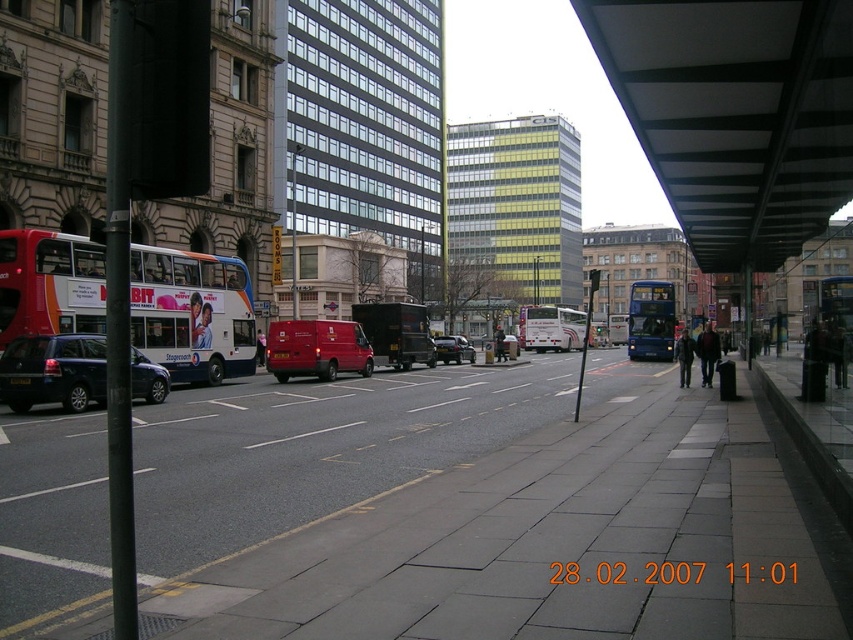
Question: Which is nearer to the matte blue bus at center?

Choices:
 (A) metallic silver car at center
 (B) red matte double-decker bus at left
 (C) matte black suv at left

Answer: (A)

Question: Can you confirm if red matte double-decker bus at left is positioned to the left of white matte bus at center?

Choices:
 (A) yes
 (B) no

Answer: (A)

Question: Estimate the real-world distances between objects in this image. Which object is farther from the matte black van at center?

Choices:
 (A) matte blue bus at center
 (B) matte black suv at left
 (C) red matte double-decker bus at left

Answer: (B)

Question: Which of the following is the closest to the observer?

Choices:
 (A) gray concrete pavement at center
 (B) metallic silver car at center
 (C) matte black van at center
 (D) metallic red van at center

Answer: (A)

Question: Is matte blue bus at center to the right of metallic silver car at center from the viewer's perspective?

Choices:
 (A) no
 (B) yes

Answer: (B)

Question: Is red matte double-decker bus at left to the right of matte black suv at left from the viewer's perspective?

Choices:
 (A) yes
 (B) no

Answer: (B)